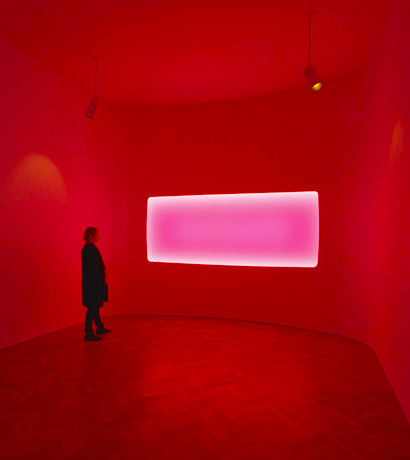
This screenshot has height=460, width=410. I want to click on floor, so (x=198, y=392).